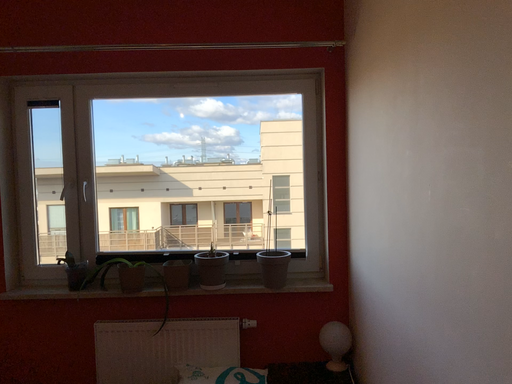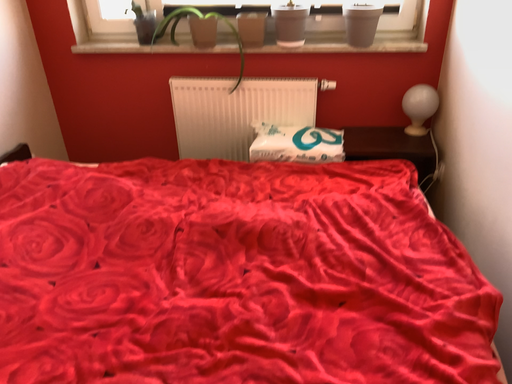
Question: How did the camera likely rotate when shooting the video?

Choices:
 (A) rotated left
 (B) rotated right

Answer: (A)